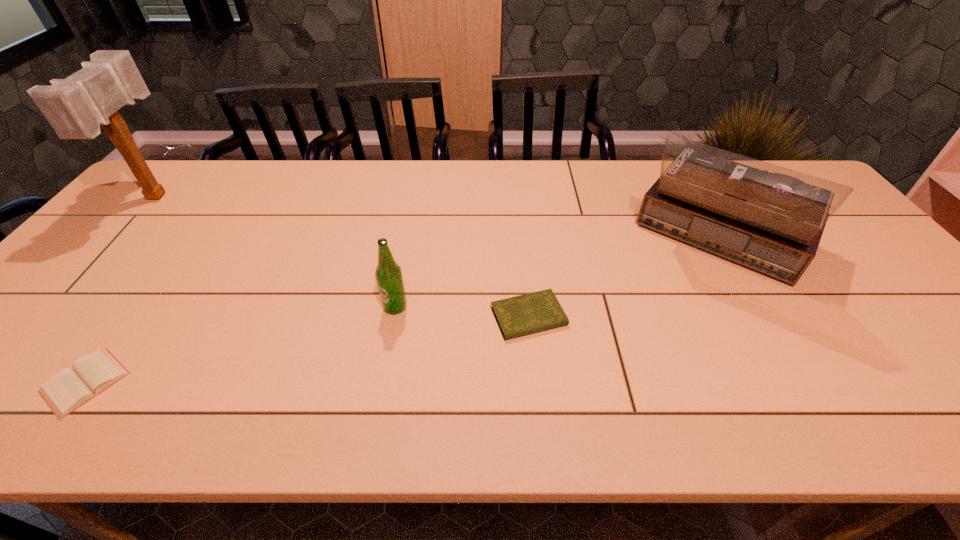
Where is `object that is at the far left corner`? object that is at the far left corner is located at coordinates (75, 107).

Identify the location of object present at the far right corner. This screenshot has height=540, width=960. (769, 218).

This screenshot has height=540, width=960. Identify the location of vacant space at the far edge. (623, 182).

Image resolution: width=960 pixels, height=540 pixels. In the image, there is a desktop. Find the location of `vacant space at the near edge`. vacant space at the near edge is located at coordinates (208, 410).

At what (x,y) coordinates should I click in order to perform the action: click on free space at the left edge of the desktop. Please return your answer as a coordinate pair (x, y). Image resolution: width=960 pixels, height=540 pixels. Looking at the image, I should click on (98, 275).

I want to click on free space between the tallest object and the second object from right to left, so click(344, 256).

Identify the location of free area in between the nearer diary and the beer bottle. The image size is (960, 540). (240, 345).

Where is `vacant space in between the fourth object from right to left and the third object from right to left`? vacant space in between the fourth object from right to left and the third object from right to left is located at coordinates (240, 345).

At what (x,y) coordinates should I click in order to perform the action: click on free area in between the second object from left to right and the mallet. Please return your answer as a coordinate pair (x, y). The image size is (960, 540). Looking at the image, I should click on (122, 289).

You are a GUI agent. You are given a task and a screenshot of the screen. Output one action in this format:
    pyautogui.click(x=<x>, y=<y>)
    Task: Click on the vacant area that lies between the third tallest object and the farther diary
    
    Given the screenshot: What is the action you would take?
    pyautogui.click(x=462, y=312)